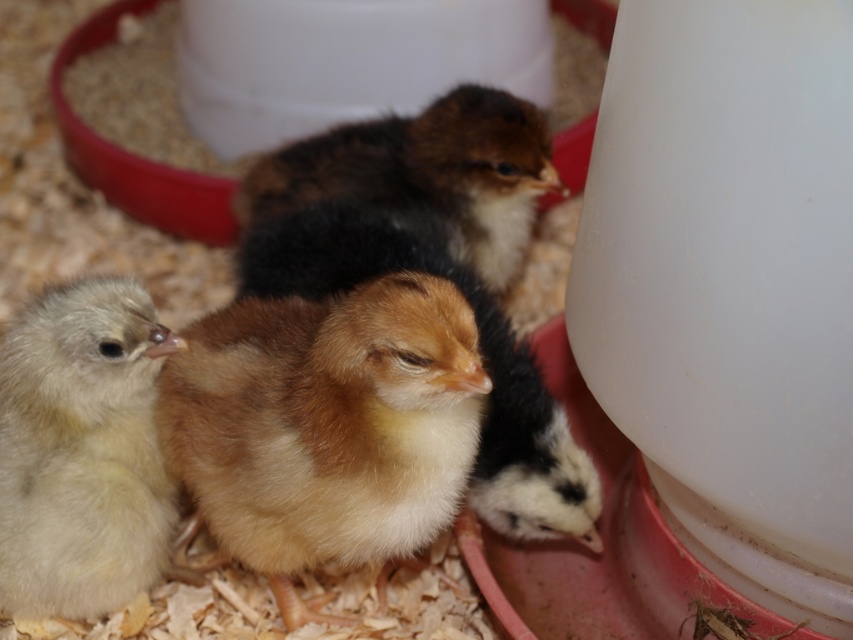
You are a farmer checking on the chicks in the brooder. You notice two chicks at the center of the image. Which one is closer to you, the fluffy yellow chick at center or the golden fluffy chick at center?

The fluffy yellow chick at center is closer to you because it is in front of the golden fluffy chick at center.

You are a farmer checking the brooder. You see the fluffy yellow chick at center and the golden fluffy chick at center. Which one is positioned to the left?

The fluffy yellow chick at center is positioned to the left of the golden fluffy chick at center.

You are a farmer checking on the chicks in the brooder. You see the light yellow fluffy chick at lower left and the brown fluffy chick at center. Which chick is positioned more to the left side of the brooder?

The light yellow fluffy chick at lower left is positioned more to the left side of the brooder than the brown fluffy chick at center.